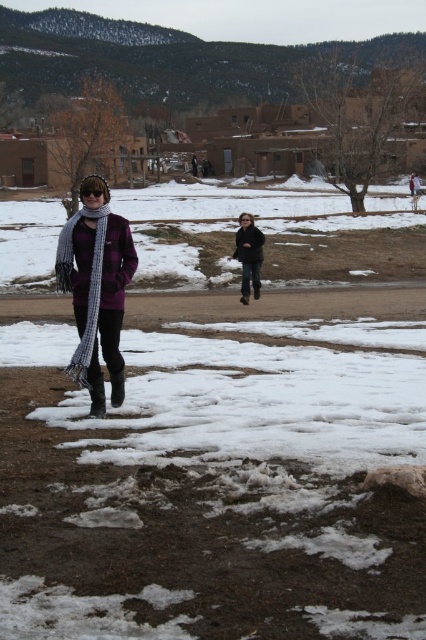
You are a photographer trying to capture a closeup of the plaid wool scarf at left and the dark gray jacket at center in the winter scene. Based on their sizes in the image, which object would require you to zoom in more to fill the frame?

The plaid wool scarf at left might be wider than dark gray jacket at center, so you might need to zoom in more on the plaid wool scarf at left to fill the frame.

You are trying to decide which item to grab first from the snowy path between the plaid wool scarf at left and the dark gray jacket at center. Based on their sizes, which one would be easier to spot from a distance?

The plaid wool scarf at left is bigger than the dark gray jacket at center, so it would be easier to spot from a distance.